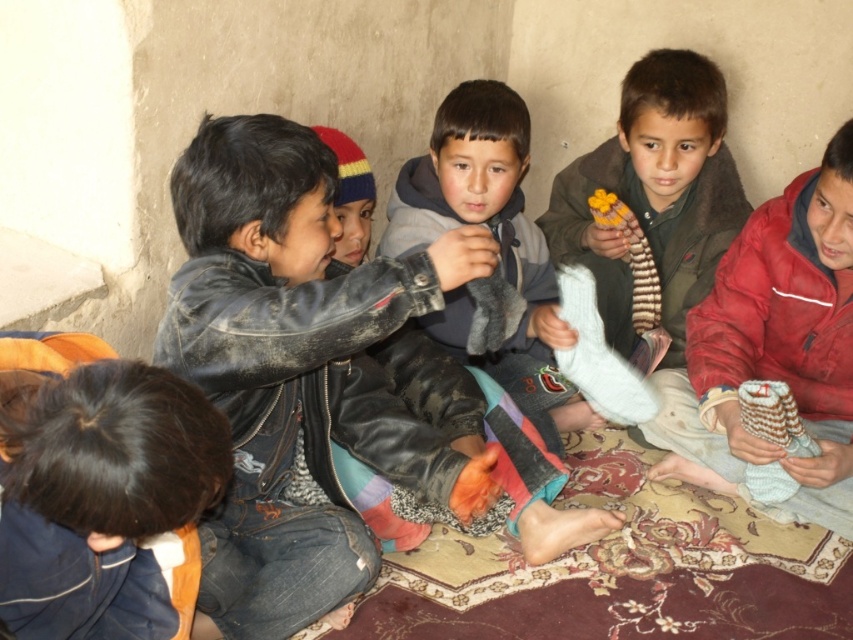
Does knitted wool socks at right appear over yellow fabric flower at center?

No, knitted wool socks at right is not above yellow fabric flower at center.

Who is positioned more to the right, knitted wool socks at right or yellow fabric flower at center?

knitted wool socks at right is more to the right.

At what (x,y) coordinates should I click in order to perform the action: click on knitted wool socks at right. Please return your answer as a coordinate pair (x, y). Looking at the image, I should click on (773, 348).

Find the location of a particular element. This screenshot has height=640, width=853. knitted wool socks at right is located at coordinates (773, 348).

Is dark blue fabric at lower left closer to camera compared to gray fleece jacket at center?

Yes, dark blue fabric at lower left is closer to the viewer.

Between point (61, 420) and point (553, 433), which one is positioned behind?

Point (553, 433)

The image size is (853, 640). Find the location of `dark blue fabric at lower left`. dark blue fabric at lower left is located at coordinates (106, 492).

Between point (49, 481) and point (691, 342), which one is positioned behind?

Positioned behind is point (691, 342).

Does dark blue fabric at lower left appear under knitted wool socks at right?

Yes, dark blue fabric at lower left is below knitted wool socks at right.

Is point (105, 588) positioned in front of point (836, 269)?

That is True.

Image resolution: width=853 pixels, height=640 pixels. I want to click on dark blue fabric at lower left, so click(106, 492).